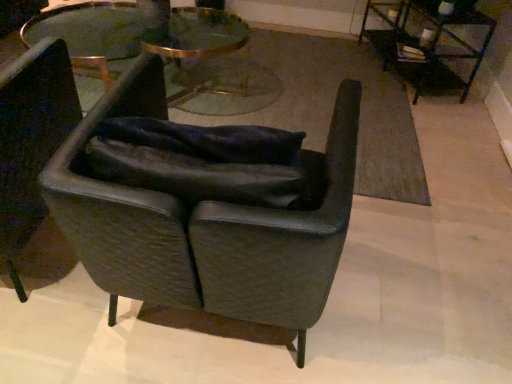
Image resolution: width=512 pixels, height=384 pixels. What do you see at coordinates (425, 47) in the screenshot? I see `metallic black table at upper right, the 1th table viewed from the right` at bounding box center [425, 47].

Image resolution: width=512 pixels, height=384 pixels. Describe the element at coordinates (31, 140) in the screenshot. I see `leather at left, which appears as the second chair when viewed from the right` at that location.

This screenshot has width=512, height=384. I want to click on metallic black table at upper right, the 1th table viewed from the right, so click(x=425, y=47).

From a real-world perspective, between leather armchair at center, which is the 2th chair in left-to-right order, and leather at left, which appears as the second chair when viewed from the right, who is vertically higher?

leather armchair at center, which is the 2th chair in left-to-right order.

Which of these two, leather armchair at center, which is the 2th chair in left-to-right order, or leather at left, placed as the first chair when sorted from left to right, stands shorter?

leather armchair at center, which is the 2th chair in left-to-right order, is shorter.

Based on their positions, is leather armchair at center, which is the 2th chair in left-to-right order, located to the left or right of leather at left, placed as the first chair when sorted from left to right?

leather armchair at center, which is the 2th chair in left-to-right order, is positioned on leather at left, placed as the first chair when sorted from left to right,'s right side.

From the image's perspective, would you say leather armchair at center, the 1th chair when ordered from right to left, is shown under leather at left, which appears as the second chair when viewed from the right?

Yes, from the image's perspective, leather armchair at center, the 1th chair when ordered from right to left, is below leather at left, which appears as the second chair when viewed from the right.

Is metallic black table at upper right, which ranks as the second table in left-to-right order, smaller than leather armchair at center, which is the 2th chair in left-to-right order?

Correct, metallic black table at upper right, which ranks as the second table in left-to-right order, occupies less space than leather armchair at center, which is the 2th chair in left-to-right order.

What's the angular difference between metallic black table at upper right, which ranks as the second table in left-to-right order, and leather armchair at center, the 1th chair when ordered from right to left,'s facing directions?

The angular difference between metallic black table at upper right, which ranks as the second table in left-to-right order, and leather armchair at center, the 1th chair when ordered from right to left, is 110 degrees.

From their relative heights in the image, would you say metallic black table at upper right, which ranks as the second table in left-to-right order, is taller or shorter than leather armchair at center, which is the 2th chair in left-to-right order?

In the image, metallic black table at upper right, which ranks as the second table in left-to-right order, appears to be shorter than leather armchair at center, which is the 2th chair in left-to-right order.

Is point (424, 74) positioned before point (324, 279)?

No, it is behind (324, 279).

How many degrees apart are the facing directions of metallic black table at upper right, the 1th table viewed from the right, and leather at left, which appears as the second chair when viewed from the right?

They differ by 110 degrees in their facing directions.

From the picture: Which of these two, metallic black table at upper right, which ranks as the second table in left-to-right order, or leather at left, which appears as the second chair when viewed from the right, is bigger?

leather at left, which appears as the second chair when viewed from the right.

Is metallic black table at upper right, the 1th table viewed from the right, inside or outside of leather at left, which appears as the second chair when viewed from the right?

metallic black table at upper right, the 1th table viewed from the right, is not inside leather at left, which appears as the second chair when viewed from the right, it's outside.

Is point (62, 91) in front of point (217, 11)?

Yes, point (62, 91) is closer to viewer.

Is leather at left, which appears as the second chair when viewed from the right, to the left of clear glass table at center, the second table from the right, from the viewer's perspective?

Correct, you'll find leather at left, which appears as the second chair when viewed from the right, to the left of clear glass table at center, the second table from the right.

Consider the image. Between leather at left, which appears as the second chair when viewed from the right, and clear glass table at center, the first table in the left-to-right sequence, which one has smaller size?

Smaller between the two is leather at left, which appears as the second chair when viewed from the right.

Is there a large distance between leather at left, placed as the first chair when sorted from left to right, and clear glass table at center, the first table in the left-to-right sequence?

That's right, there is a large distance between leather at left, placed as the first chair when sorted from left to right, and clear glass table at center, the first table in the left-to-right sequence.

Could you tell me if clear glass table at center, the first table in the left-to-right sequence, is facing metallic black table at upper right, the 1th table viewed from the right?

No, clear glass table at center, the first table in the left-to-right sequence, is not aimed at metallic black table at upper right, the 1th table viewed from the right.

Is clear glass table at center, the second table from the right, behind metallic black table at upper right, the 1th table viewed from the right?

No, it is not.

Would you say metallic black table at upper right, which ranks as the second table in left-to-right order, is part of clear glass table at center, the second table from the right,'s contents?

No, metallic black table at upper right, which ranks as the second table in left-to-right order, is not surrounded by clear glass table at center, the second table from the right.

From the image's perspective, is metallic black table at upper right, which ranks as the second table in left-to-right order, located beneath clear glass table at center, the second table from the right?

No.

Is metallic black table at upper right, which ranks as the second table in left-to-right order, oriented away from clear glass table at center, the first table in the left-to-right sequence?

metallic black table at upper right, which ranks as the second table in left-to-right order, is not turned away from clear glass table at center, the first table in the left-to-right sequence.

Is metallic black table at upper right, the 1th table viewed from the right, in contact with clear glass table at center, the first table in the left-to-right sequence?

No, metallic black table at upper right, the 1th table viewed from the right, is not beside clear glass table at center, the first table in the left-to-right sequence.

Does metallic black table at upper right, which ranks as the second table in left-to-right order, have a larger size compared to clear glass table at center, the first table in the left-to-right sequence?

Actually, metallic black table at upper right, which ranks as the second table in left-to-right order, might be smaller than clear glass table at center, the first table in the left-to-right sequence.

Are clear glass table at center, the second table from the right, and leather armchair at center, which is the 2th chair in left-to-right order, beside each other?

No.

Is clear glass table at center, the first table in the left-to-right sequence, looking in the opposite direction of leather armchair at center, which is the 2th chair in left-to-right order?

No, leather armchair at center, which is the 2th chair in left-to-right order, is not at the back of clear glass table at center, the first table in the left-to-right sequence.

There is a leather armchair at center, which is the 2th chair in left-to-right order. Where is `the 1st table above it (from the image's perspective)`? The width and height of the screenshot is (512, 384). the 1st table above it (from the image's perspective) is located at coordinates (91, 40).

From a real-world perspective, between clear glass table at center, the second table from the right, and leather armchair at center, which is the 2th chair in left-to-right order, who is vertically higher?

In real-world perspective, leather armchair at center, which is the 2th chair in left-to-right order, is above.

Where is `chair behind the leather armchair at center, which is the 2th chair in left-to-right order`? Image resolution: width=512 pixels, height=384 pixels. chair behind the leather armchair at center, which is the 2th chair in left-to-right order is located at coordinates (31, 140).

Locate an element on the screen. The height and width of the screenshot is (384, 512). table on the right side of leather armchair at center, which is the 2th chair in left-to-right order is located at coordinates (425, 47).

Looking at the image, which one is located closer to clear glass table at center, the first table in the left-to-right sequence, metallic black table at upper right, the 1th table viewed from the right, or leather armchair at center, the 1th chair when ordered from right to left?

Among the two, metallic black table at upper right, the 1th table viewed from the right, is located nearer to clear glass table at center, the first table in the left-to-right sequence.

Considering their positions, is leather at left, placed as the first chair when sorted from left to right, positioned further to metallic black table at upper right, the 1th table viewed from the right, than leather armchair at center, the 1th chair when ordered from right to left?

leather at left, placed as the first chair when sorted from left to right.

Based on the photo, from the image, which object appears to be nearer to metallic black table at upper right, the 1th table viewed from the right, clear glass table at center, the first table in the left-to-right sequence, or leather armchair at center, the 1th chair when ordered from right to left?

Among the two, leather armchair at center, the 1th chair when ordered from right to left, is located nearer to metallic black table at upper right, the 1th table viewed from the right.

Consider the image. Considering their positions, is leather armchair at center, the 1th chair when ordered from right to left, positioned further to metallic black table at upper right, the 1th table viewed from the right, than clear glass table at center, the first table in the left-to-right sequence?

clear glass table at center, the first table in the left-to-right sequence, is positioned further to the anchor metallic black table at upper right, the 1th table viewed from the right.

When comparing their distances from clear glass table at center, the first table in the left-to-right sequence, does leather armchair at center, the 1th chair when ordered from right to left, or leather at left, placed as the first chair when sorted from left to right, seem closer?

leather at left, placed as the first chair when sorted from left to right, is positioned closer to the anchor clear glass table at center, the first table in the left-to-right sequence.

Which object lies further to the anchor point leather armchair at center, which is the 2th chair in left-to-right order, leather at left, placed as the first chair when sorted from left to right, or metallic black table at upper right, the 1th table viewed from the right?

The object further to leather armchair at center, which is the 2th chair in left-to-right order, is metallic black table at upper right, the 1th table viewed from the right.

Looking at the image, which one is located further to leather armchair at center, the 1th chair when ordered from right to left, metallic black table at upper right, the 1th table viewed from the right, or clear glass table at center, the second table from the right?

Among the two, clear glass table at center, the second table from the right, is located further to leather armchair at center, the 1th chair when ordered from right to left.

When comparing their distances from clear glass table at center, the first table in the left-to-right sequence, does leather at left, which appears as the second chair when viewed from the right, or leather armchair at center, which is the 2th chair in left-to-right order, seem further?

Based on the image, leather armchair at center, which is the 2th chair in left-to-right order, appears to be further to clear glass table at center, the first table in the left-to-right sequence.

The height and width of the screenshot is (384, 512). In order to click on chair between clear glass table at center, the first table in the left-to-right sequence, and metallic black table at upper right, the 1th table viewed from the right, from left to right in this screenshot , I will do `click(207, 224)`.

At what (x,y) coordinates should I click in order to perform the action: click on chair positioned between leather armchair at center, the 1th chair when ordered from right to left, and clear glass table at center, the second table from the right, from near to far. Please return your answer as a coordinate pair (x, y). This screenshot has height=384, width=512. Looking at the image, I should click on click(31, 140).

The image size is (512, 384). What are the coordinates of `chair located between leather at left, which appears as the second chair when viewed from the right, and metallic black table at upper right, the 1th table viewed from the right, in the left-right direction` in the screenshot? It's located at (207, 224).

You are a GUI agent. You are given a task and a screenshot of the screen. Output one action in this format:
    pyautogui.click(x=<x>, y=<y>)
    Task: Click on the table between leather at left, placed as the first chair when sorted from left to right, and metallic black table at upper right, which ranks as the second table in left-to-right order, in the horizontal direction
    This screenshot has height=384, width=512.
    Given the screenshot: What is the action you would take?
    pyautogui.click(x=91, y=40)